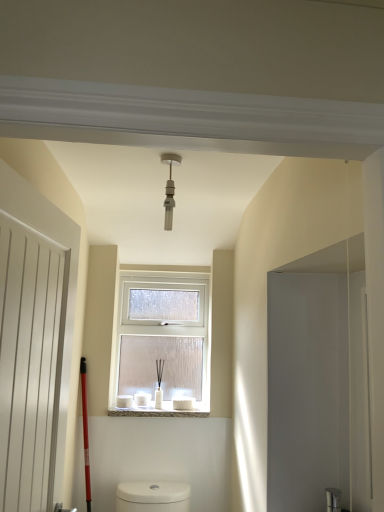
Find the location of a particular element. The height and width of the screenshot is (512, 384). vacant area on top of white frosted glass window at center (from a real-world perspective) is located at coordinates (163, 275).